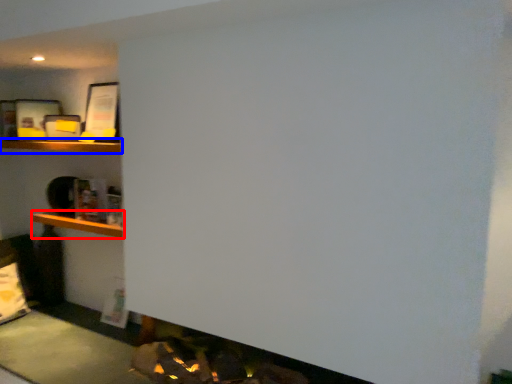
Question: Which of the following is the closest to the observer, cabinet (highlighted by a red box) or shelf (highlighted by a blue box)?

Choices:
 (A) cabinet
 (B) shelf

Answer: (B)